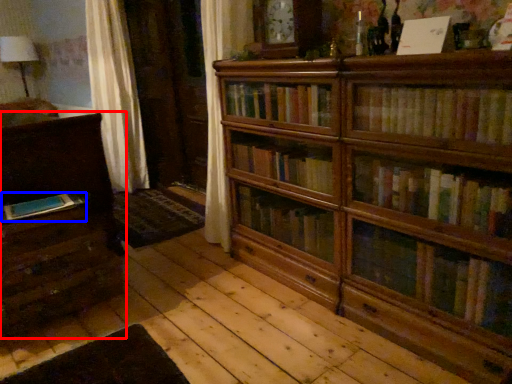
Question: Which of the following is the farthest to the observer, chest of drawers (highlighted by a red box) or book (highlighted by a blue box)?

Choices:
 (A) chest of drawers
 (B) book

Answer: (A)